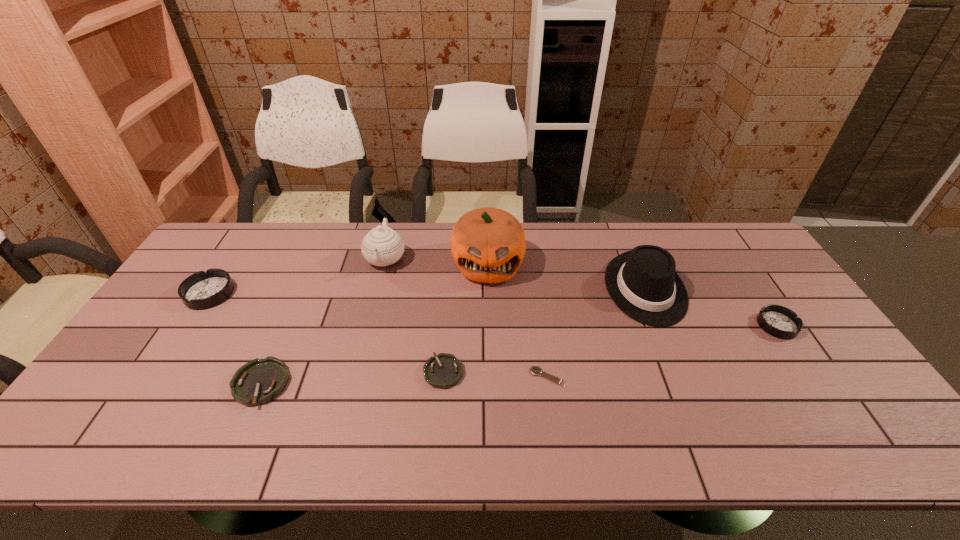
In order to click on the tallest object in this screenshot , I will do `click(488, 245)`.

Where is `chinaware`? chinaware is located at coordinates (382, 246).

Find the location of a particular element. the sixth shortest object is located at coordinates (643, 284).

The image size is (960, 540). Find the location of `the seventh object from left to right`. the seventh object from left to right is located at coordinates (643, 284).

In order to click on the fourth tallest object in this screenshot , I will do `click(202, 290)`.

Find the location of a particular element. Image resolution: width=960 pixels, height=540 pixels. the farther dark ashtray is located at coordinates (202, 290).

In order to click on the rightmost object in this screenshot , I will do click(778, 321).

You are a GUI agent. You are given a task and a screenshot of the screen. Output one action in this format:
    pyautogui.click(x=<x>, y=<y>)
    Task: Click on the right dark ashtray
    
    Given the screenshot: What is the action you would take?
    pyautogui.click(x=778, y=321)

You are a GUI agent. You are given a task and a screenshot of the screen. Output one action in this format:
    pyautogui.click(x=<x>, y=<y>)
    Task: Click on the third ashtray from right to left
    
    Given the screenshot: What is the action you would take?
    pyautogui.click(x=259, y=381)

Identify the location of the bigger green ashtray. This screenshot has width=960, height=540. (259, 381).